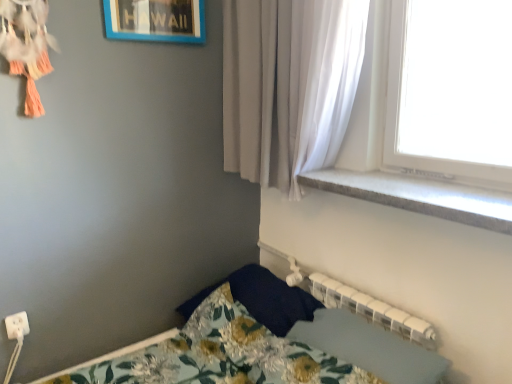
Where is `blank space situated above gray concrete window sill at upper right (from a real-world perspective)`? blank space situated above gray concrete window sill at upper right (from a real-world perspective) is located at coordinates (424, 188).